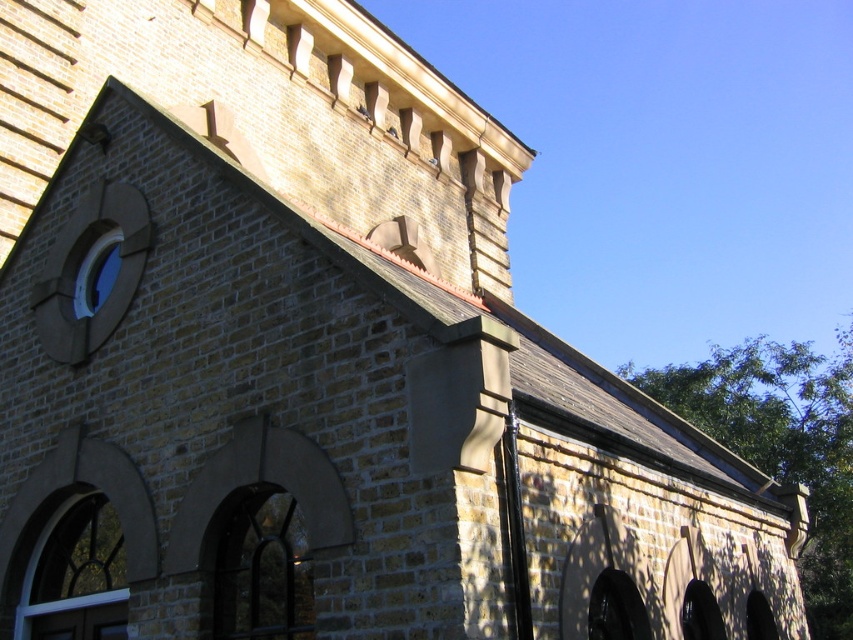
Which is in front, point (297, 612) or point (71, 605)?

Point (297, 612) is in front.

Is dark glass window at lower center positioned in front of stained glass window at lower left?

Yes, dark glass window at lower center is in front of stained glass window at lower left.

Between point (288, 534) and point (82, 516), which one is positioned in front?

Point (288, 534)

What are the coordinates of `dark glass window at lower center` in the screenshot? It's located at (262, 570).

Based on the photo, does stained glass window at lower left appear over transparent glass window at upper left?

Incorrect, stained glass window at lower left is not positioned above transparent glass window at upper left.

Is stained glass window at lower left smaller than transparent glass window at upper left?

No, stained glass window at lower left is not smaller than transparent glass window at upper left.

This screenshot has width=853, height=640. Find the location of `stained glass window at lower left`. stained glass window at lower left is located at coordinates (76, 576).

Who is shorter, dark glass window at lower center or transparent glass window at upper left?

Standing shorter between the two is transparent glass window at upper left.

Is dark glass window at lower center smaller than transparent glass window at upper left?

No, dark glass window at lower center is not smaller than transparent glass window at upper left.

Who is more forward, (x=268, y=556) or (x=106, y=278)?

Point (x=268, y=556) is in front.

This screenshot has width=853, height=640. I want to click on dark glass window at lower center, so click(x=262, y=570).